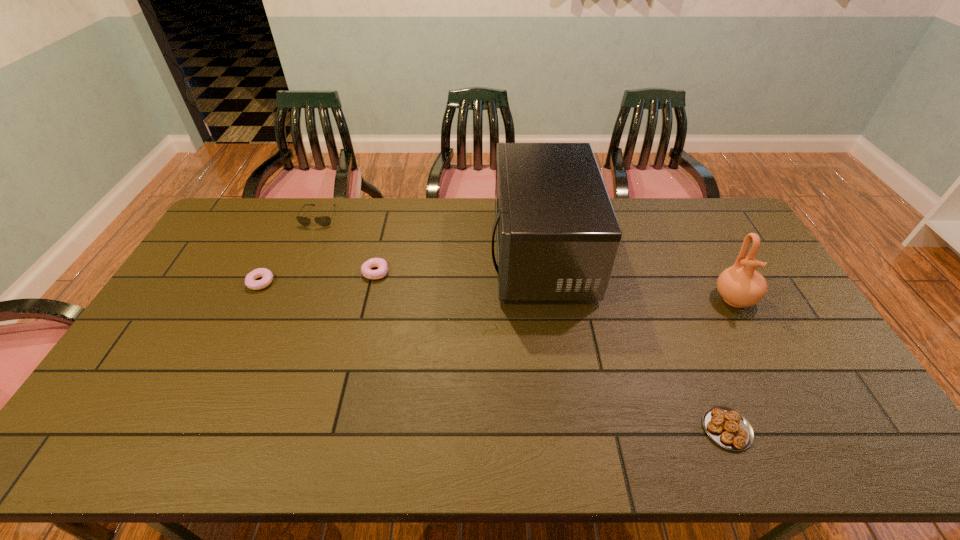
The height and width of the screenshot is (540, 960). I want to click on object located at the right edge, so click(740, 285).

In the image, there is a desktop. Identify the location of free region at the far edge. (444, 219).

At what (x,y) coordinates should I click in order to perform the action: click on vacant space at the near edge of the desktop. Please return your answer as a coordinate pair (x, y). This screenshot has height=540, width=960. Looking at the image, I should click on (356, 429).

This screenshot has width=960, height=540. Find the location of `free space at the right edge of the desktop`. free space at the right edge of the desktop is located at coordinates (762, 261).

The image size is (960, 540). Identify the location of vacant area at the near right corner of the desktop. (838, 443).

Identify the location of free space between the nearest object and the third object from left to right. (551, 350).

The height and width of the screenshot is (540, 960). In order to click on vacant point located between the right doughnut and the tallest object in this screenshot , I will do `click(458, 262)`.

At what (x,y) coordinates should I click in order to perform the action: click on unoccupied area between the fourth object from right to left and the second object from right to left. Please return your answer as a coordinate pair (x, y). This screenshot has height=540, width=960. Looking at the image, I should click on (551, 350).

I want to click on free space between the nearest object and the sunglasses, so click(x=523, y=322).

Where is `empty space between the fourth object from left to right and the nearest object`? The width and height of the screenshot is (960, 540). empty space between the fourth object from left to right and the nearest object is located at coordinates (634, 341).